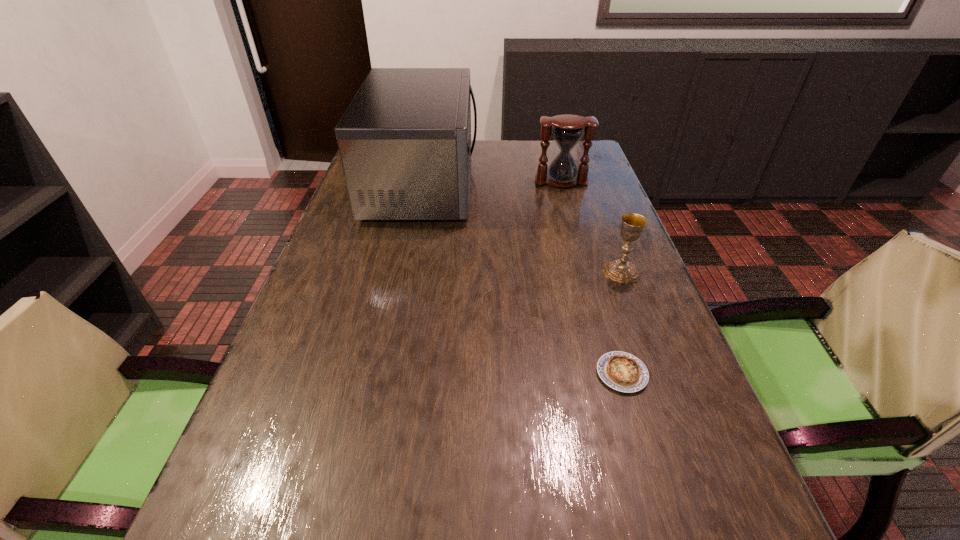
Locate an element on the screen. Image resolution: width=960 pixels, height=540 pixels. vacant area located 0.380m on the back of the shortest object is located at coordinates (583, 241).

This screenshot has height=540, width=960. Identify the location of object present at the far edge. (405, 139).

Locate an element on the screen. This screenshot has width=960, height=540. object that is at the left edge is located at coordinates (405, 139).

What are the coordinates of `hourglass that is at the right edge` in the screenshot? It's located at (567, 130).

Where is `chalice that is at the right edge`? The width and height of the screenshot is (960, 540). chalice that is at the right edge is located at coordinates (622, 271).

Image resolution: width=960 pixels, height=540 pixels. I want to click on quiche that is at the right edge, so click(624, 372).

The height and width of the screenshot is (540, 960). Find the location of `object located at the far left corner`. object located at the far left corner is located at coordinates (405, 139).

The image size is (960, 540). What are the coordinates of `vacant region at the far edge of the desktop` in the screenshot? It's located at (540, 146).

The width and height of the screenshot is (960, 540). In the image, there is a desktop. Identify the location of vacant space at the left edge. (278, 430).

Identify the location of free space at the right edge. click(x=599, y=177).